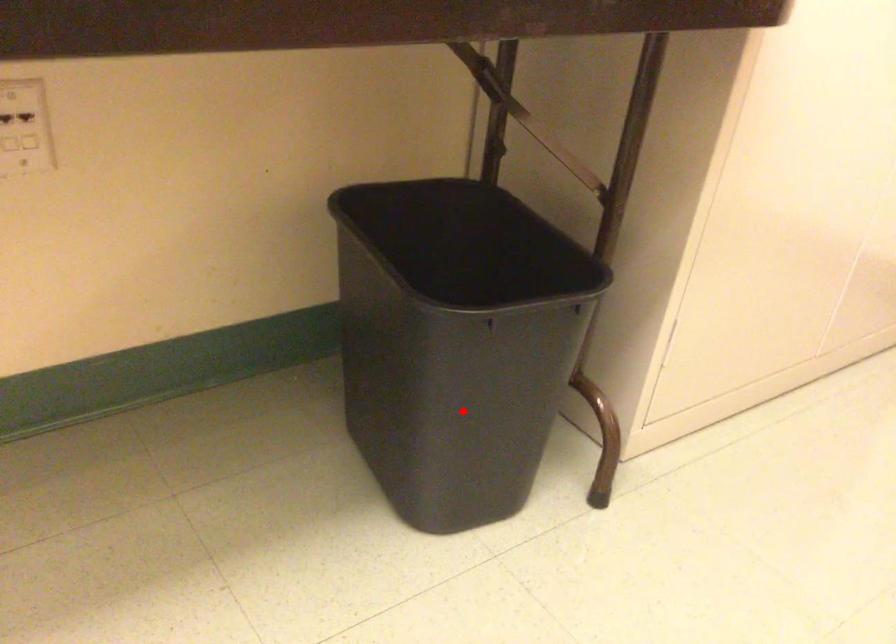
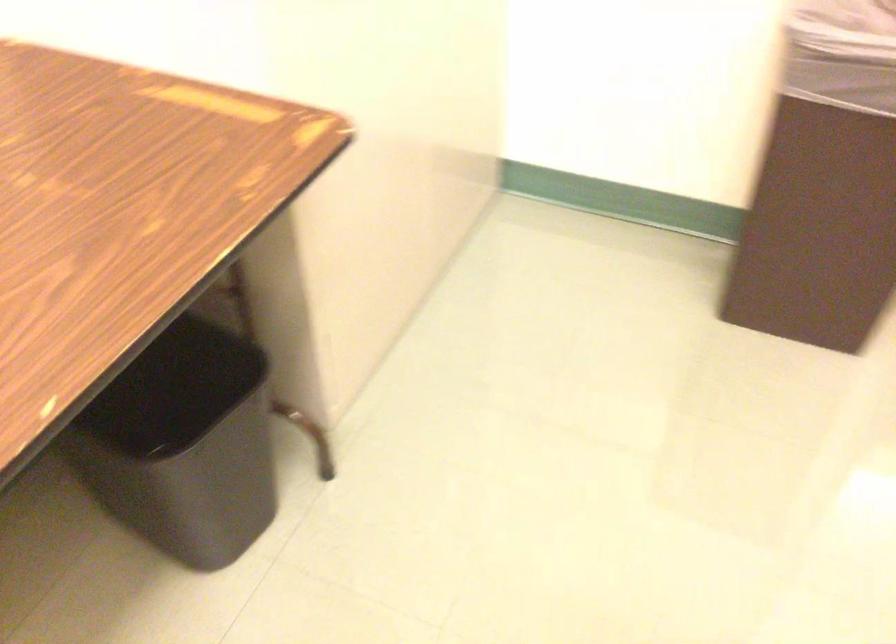
Where in the second image is the point corresponding to the highlighted location from the first image?

(213, 489)